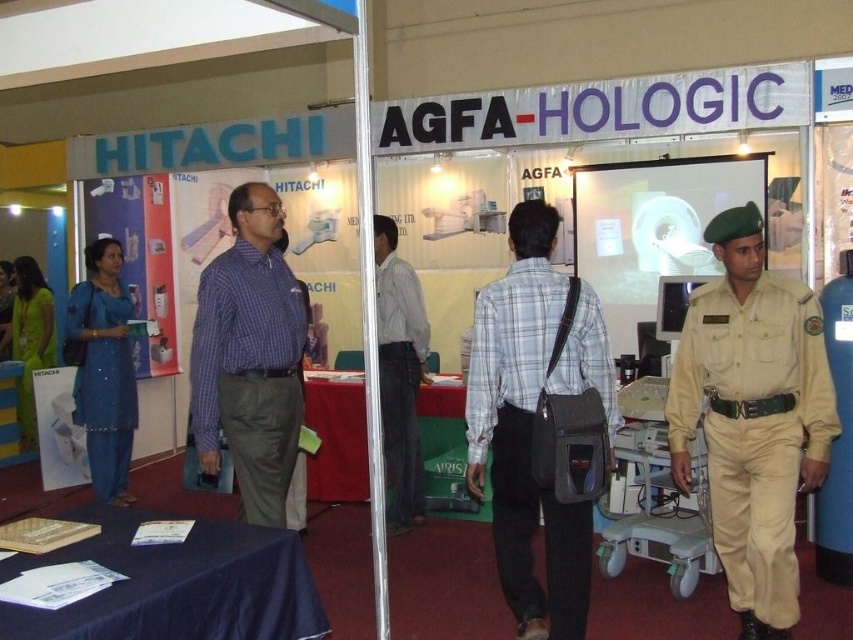
You are a visitor at the exhibition and want to pick up the gray fabric bag at center and the blue checkered shirt at center. Which item is taller?

The gray fabric bag at center is taller than the blue checkered shirt at center.

You are an attendee at the exhibition and you see the gray fabric bag at center and the blue checkered shirt at center. Which one is positioned lower in the image?

The gray fabric bag at center is positioned below the blue checkered shirt at center, so it is lower in the image.